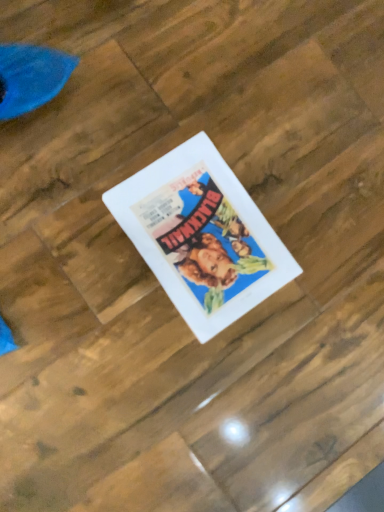
Locate an element on the screen. This screenshot has height=512, width=384. free region under white paper at center (from a real-world perspective) is located at coordinates (202, 232).